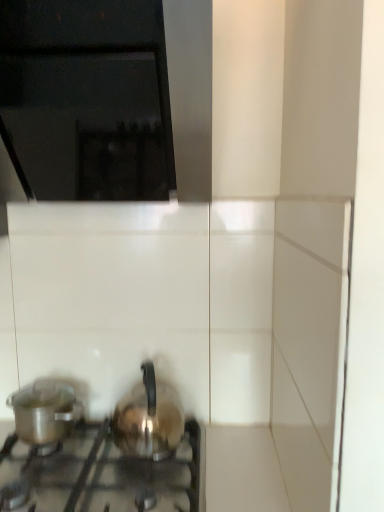
Locate an element on the screen. metallic silver pot at lower left, which is the first kitchen appliance from left to right is located at coordinates (45, 411).

Describe the element at coordinates (87, 98) in the screenshot. I see `black glass vent at upper left` at that location.

At what (x,y) coordinates should I click in order to perform the action: click on shiny metallic kettle at center, the second kitchen appliance viewed from the left. Please return your answer as a coordinate pair (x, y). This screenshot has width=384, height=512. Looking at the image, I should click on (148, 418).

Image resolution: width=384 pixels, height=512 pixels. In order to click on metallic silver pot at lower left, the 2th kitchen appliance in the right-to-left sequence in this screenshot , I will do `click(45, 411)`.

Based on the photo, which is less distant, (114, 115) or (33, 406)?

The point (114, 115) is closer to the camera.

Is black glass vent at upper left situated inside metallic silver pot at lower left, which is the first kitchen appliance from left to right, or outside?

The correct answer is: outside.

Considering the relative positions of black glass vent at upper left and metallic silver pot at lower left, the 2th kitchen appliance in the right-to-left sequence, in the image provided, is black glass vent at upper left to the left of metallic silver pot at lower left, the 2th kitchen appliance in the right-to-left sequence, from the viewer's perspective?

In fact, black glass vent at upper left is to the right of metallic silver pot at lower left, the 2th kitchen appliance in the right-to-left sequence.

Does metallic silver pot at lower left, which is the first kitchen appliance from left to right, have a larger size compared to shiny metallic kettle at center, the first kitchen appliance in the right-to-left sequence?

No.

Is metallic silver pot at lower left, which is the first kitchen appliance from left to right, oriented towards shiny metallic kettle at center, the first kitchen appliance in the right-to-left sequence?

No, metallic silver pot at lower left, which is the first kitchen appliance from left to right, is not aimed at shiny metallic kettle at center, the first kitchen appliance in the right-to-left sequence.

Locate an element on the screen. This screenshot has width=384, height=512. kitchen appliance that appears on the right of metallic silver pot at lower left, the 2th kitchen appliance in the right-to-left sequence is located at coordinates (148, 418).

Which object is positioned more to the left, metallic silver pot at lower left, the 2th kitchen appliance in the right-to-left sequence, or shiny metallic kettle at center, the second kitchen appliance viewed from the left?

metallic silver pot at lower left, the 2th kitchen appliance in the right-to-left sequence.

Locate an element on the screen. Image resolution: width=384 pixels, height=512 pixels. kitchen appliance that is the 2nd object located above the satin silver kettle at lower left (from the image's perspective) is located at coordinates (148, 418).

Between satin silver kettle at lower left and shiny metallic kettle at center, the second kitchen appliance viewed from the left, which one has smaller size?

Smaller between the two is shiny metallic kettle at center, the second kitchen appliance viewed from the left.

Looking at this image, considering their positions, is satin silver kettle at lower left located in front of or behind shiny metallic kettle at center, the first kitchen appliance in the right-to-left sequence?

satin silver kettle at lower left is positioned closer to the viewer than shiny metallic kettle at center, the first kitchen appliance in the right-to-left sequence.

Is shiny metallic kettle at center, the second kitchen appliance viewed from the left, taller than satin silver kettle at lower left?

Yes, shiny metallic kettle at center, the second kitchen appliance viewed from the left, is taller than satin silver kettle at lower left.

In the scene shown: Considering the sizes of objects shiny metallic kettle at center, the first kitchen appliance in the right-to-left sequence, and satin silver kettle at lower left in the image provided, who is thinner, shiny metallic kettle at center, the first kitchen appliance in the right-to-left sequence, or satin silver kettle at lower left?

Thinner between the two is shiny metallic kettle at center, the first kitchen appliance in the right-to-left sequence.

Is shiny metallic kettle at center, the first kitchen appliance in the right-to-left sequence, outside of satin silver kettle at lower left?

shiny metallic kettle at center, the first kitchen appliance in the right-to-left sequence, lies outside satin silver kettle at lower left's area.

Who is smaller, shiny metallic kettle at center, the first kitchen appliance in the right-to-left sequence, or satin silver kettle at lower left?

shiny metallic kettle at center, the first kitchen appliance in the right-to-left sequence.

Is black glass vent at upper left bigger than satin silver kettle at lower left?

Indeed, black glass vent at upper left has a larger size compared to satin silver kettle at lower left.

Based on the photo, are black glass vent at upper left and satin silver kettle at lower left far apart?

No, black glass vent at upper left is not far from satin silver kettle at lower left.

From the image's perspective, between black glass vent at upper left and satin silver kettle at lower left, which one is located above?

black glass vent at upper left, from the image's perspective.

Is black glass vent at upper left inside the boundaries of satin silver kettle at lower left, or outside?

black glass vent at upper left is spatially situated outside satin silver kettle at lower left.

Can we say satin silver kettle at lower left lies outside black glass vent at upper left?

Yes.

Based on the photo, can you tell me how much satin silver kettle at lower left and black glass vent at upper left differ in facing direction?

They differ by 0.277 degrees in their facing directions.

How distant is satin silver kettle at lower left from black glass vent at upper left?

satin silver kettle at lower left is 32.40 inches away from black glass vent at upper left.

Can you confirm if satin silver kettle at lower left is smaller than black glass vent at upper left?

Correct, satin silver kettle at lower left occupies less space than black glass vent at upper left.

Considering the positions of objects metallic silver pot at lower left, which is the first kitchen appliance from left to right, and satin silver kettle at lower left in the image provided, who is more to the left, metallic silver pot at lower left, which is the first kitchen appliance from left to right, or satin silver kettle at lower left?

Positioned to the left is metallic silver pot at lower left, which is the first kitchen appliance from left to right.

Relative to satin silver kettle at lower left, is metallic silver pot at lower left, the 2th kitchen appliance in the right-to-left sequence, in front or behind?

Clearly, metallic silver pot at lower left, the 2th kitchen appliance in the right-to-left sequence, is behind satin silver kettle at lower left.

From the image's perspective, between metallic silver pot at lower left, the 2th kitchen appliance in the right-to-left sequence, and satin silver kettle at lower left, which one is located above?

metallic silver pot at lower left, the 2th kitchen appliance in the right-to-left sequence, from the image's perspective.

From a real-world perspective, count 2nd kitchen appliances downward from the black glass vent at upper left and point to it. Please provide its 2D coordinates.

[(45, 411)]

Locate an element on the screen. kitchen appliance above the metallic silver pot at lower left, the 2th kitchen appliance in the right-to-left sequence (from a real-world perspective) is located at coordinates (148, 418).

Which object lies further to the anchor point metallic silver pot at lower left, which is the first kitchen appliance from left to right, black glass vent at upper left or satin silver kettle at lower left?

black glass vent at upper left is positioned further to the anchor metallic silver pot at lower left, which is the first kitchen appliance from left to right.

Which object lies nearer to the anchor point black glass vent at upper left, satin silver kettle at lower left or metallic silver pot at lower left, the 2th kitchen appliance in the right-to-left sequence?

The object closer to black glass vent at upper left is metallic silver pot at lower left, the 2th kitchen appliance in the right-to-left sequence.

When comparing their distances from satin silver kettle at lower left, does black glass vent at upper left or metallic silver pot at lower left, which is the first kitchen appliance from left to right, seem closer?

Among the two, metallic silver pot at lower left, which is the first kitchen appliance from left to right, is located nearer to satin silver kettle at lower left.

Based on their spatial positions, is metallic silver pot at lower left, which is the first kitchen appliance from left to right, or satin silver kettle at lower left further from black glass vent at upper left?

satin silver kettle at lower left lies further to black glass vent at upper left than the other object.

Based on their spatial positions, is satin silver kettle at lower left or metallic silver pot at lower left, which is the first kitchen appliance from left to right, closer to shiny metallic kettle at center, the first kitchen appliance in the right-to-left sequence?

The object closer to shiny metallic kettle at center, the first kitchen appliance in the right-to-left sequence, is satin silver kettle at lower left.

Based on their spatial positions, is satin silver kettle at lower left or shiny metallic kettle at center, the second kitchen appliance viewed from the left, further from black glass vent at upper left?

satin silver kettle at lower left lies further to black glass vent at upper left than the other object.

Estimate the real-world distances between objects in this image. Which object is further from satin silver kettle at lower left, black glass vent at upper left or shiny metallic kettle at center, the first kitchen appliance in the right-to-left sequence?

black glass vent at upper left.

When comparing their distances from metallic silver pot at lower left, which is the first kitchen appliance from left to right, does black glass vent at upper left or shiny metallic kettle at center, the second kitchen appliance viewed from the left, seem further?

black glass vent at upper left is positioned further to the anchor metallic silver pot at lower left, which is the first kitchen appliance from left to right.

What are the coordinates of `gas stove between metallic silver pot at lower left, which is the first kitchen appliance from left to right, and shiny metallic kettle at center, the first kitchen appliance in the right-to-left sequence, in the horizontal direction` in the screenshot? It's located at coord(101,474).

The width and height of the screenshot is (384, 512). I want to click on kitchen appliance that lies between black glass vent at upper left and metallic silver pot at lower left, the 2th kitchen appliance in the right-to-left sequence, from top to bottom, so click(x=148, y=418).